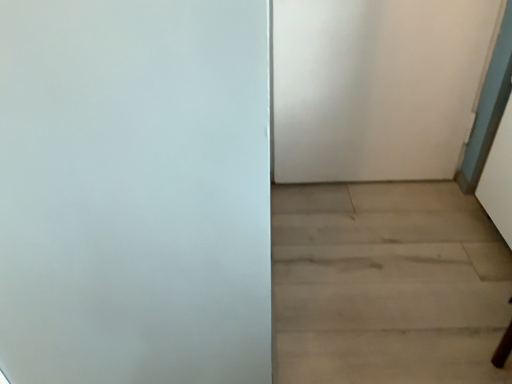
Question: In the image, is white matte door at upper right positioned in front of or behind light wood floor at lower right?

Choices:
 (A) behind
 (B) front

Answer: (A)

Question: Is white matte door at upper right wider or thinner than light wood floor at lower right?

Choices:
 (A) wide
 (B) thin

Answer: (B)

Question: Does point (386, 160) appear closer or farther from the camera than point (366, 362)?

Choices:
 (A) farther
 (B) closer

Answer: (A)

Question: Based on their positions, is light wood floor at lower right located to the left or right of white matte door at upper right?

Choices:
 (A) left
 (B) right

Answer: (B)

Question: Looking at their shapes, would you say light wood floor at lower right is wider or thinner than white matte door at upper right?

Choices:
 (A) wide
 (B) thin

Answer: (A)

Question: From the image's perspective, relative to white matte door at upper right, is light wood floor at lower right above or below?

Choices:
 (A) below
 (B) above

Answer: (A)

Question: Is point (293, 264) closer or farther from the camera than point (335, 84)?

Choices:
 (A) farther
 (B) closer

Answer: (B)